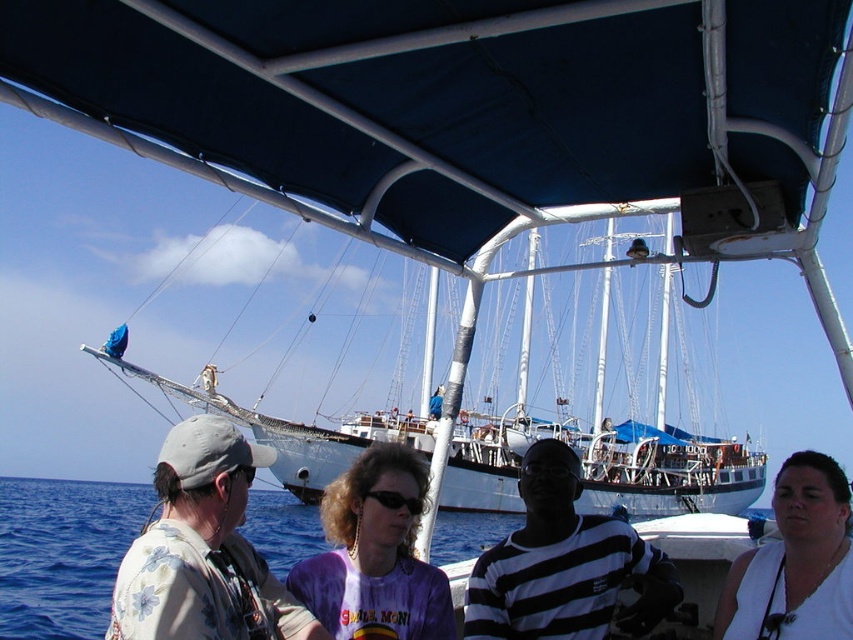
Consider the image. You are standing on the deck of the boat and want to know if the blue fabric canopy at upper center can provide shade for the floral shirt at left. Based on their sizes, is the canopy large enough to cover the shirt?

The blue fabric canopy at upper center has a larger size compared to the floral shirt at left, so yes, the canopy is large enough to provide shade for the floral shirt at left.

You are standing on the boat and want to take a photo of the black striped shirt at center without including the blue fabric canopy at upper center in the frame. Is this possible given their positions?

The blue fabric canopy at upper center is closer to the viewer than the black striped shirt at center, so it would block the view of the shirt. Therefore, it is not possible to take a photo of the black striped shirt at center without including the blue fabric canopy at upper center in the frame.